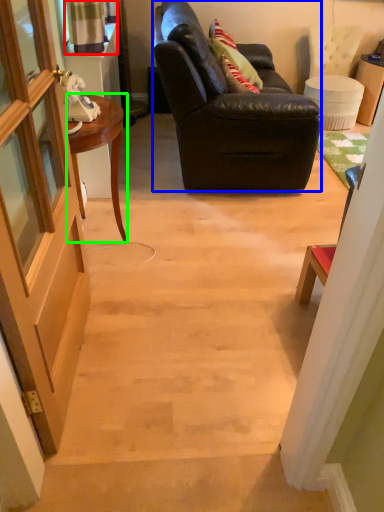
Question: Estimate the real-world distances between objects in this image. Which object is closer to curtain (highlighted by a red box), studio couch (highlighted by a blue box) or desk (highlighted by a green box)?

Choices:
 (A) studio couch
 (B) desk

Answer: (B)